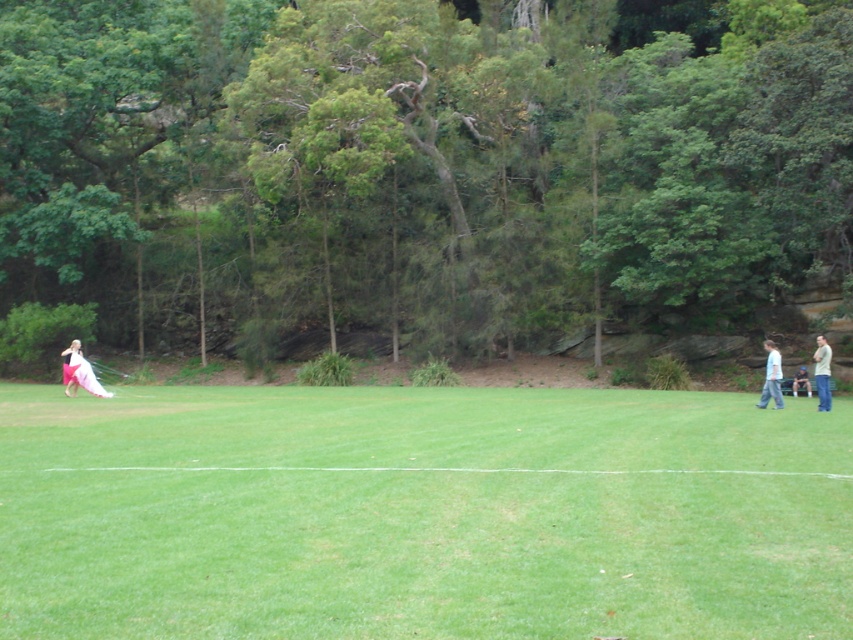
Between green leafy tree at upper center and blue denim jeans at lower right, which one is positioned higher?

Positioned higher is green leafy tree at upper center.

Between point (541, 236) and point (792, 388), which one is positioned behind?

The point (541, 236) is more distant.

Find the location of `green leafy tree at upper center`. green leafy tree at upper center is located at coordinates (421, 168).

Locate an element on the screen. The height and width of the screenshot is (640, 853). green leafy tree at upper center is located at coordinates (421, 168).

Does green grass at center appear on the right side of white satin dress at left?

Correct, you'll find green grass at center to the right of white satin dress at left.

Between green grass at center and white satin dress at left, which one is positioned lower?

Result: green grass at center

I want to click on green grass at center, so click(421, 513).

Based on the photo, between matte pink dress at left and light blue cotton shirt at right, which one has less height?

With less height is matte pink dress at left.

Does matte pink dress at left appear under light blue cotton shirt at right?

Yes, matte pink dress at left is below light blue cotton shirt at right.

Identify the location of matte pink dress at left. Image resolution: width=853 pixels, height=640 pixels. (79, 372).